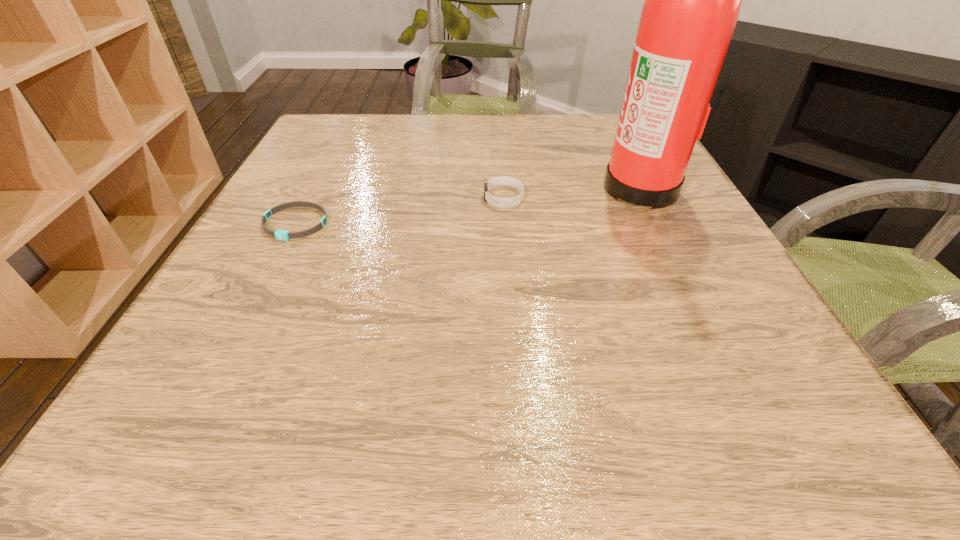
The width and height of the screenshot is (960, 540). Find the location of `vacant area that satisfies the following two spatial constraints: 1. on the outer surface of the second object from right to left; 2. on the buckle of the left wristband`. vacant area that satisfies the following two spatial constraints: 1. on the outer surface of the second object from right to left; 2. on the buckle of the left wristband is located at coordinates (506, 224).

Find the location of a particular element. The height and width of the screenshot is (540, 960). vacant position in the image that satisfies the following two spatial constraints: 1. on the label side of the tallest object; 2. on the buckle of the shortest object is located at coordinates (660, 224).

Where is `vacant position in the image that satisfies the following two spatial constraints: 1. on the label side of the rightmost object; 2. on the buckle of the leftmost object`? The image size is (960, 540). vacant position in the image that satisfies the following two spatial constraints: 1. on the label side of the rightmost object; 2. on the buckle of the leftmost object is located at coordinates (660, 224).

Where is `free spot that satisfies the following two spatial constraints: 1. on the outer surface of the second tallest object; 2. on the buckle of the left wristband`? The width and height of the screenshot is (960, 540). free spot that satisfies the following two spatial constraints: 1. on the outer surface of the second tallest object; 2. on the buckle of the left wristband is located at coordinates (506, 224).

Identify the location of vacant space that satisfies the following two spatial constraints: 1. on the label side of the rightmost object; 2. on the buckle of the leftmost object. (660, 224).

The image size is (960, 540). I want to click on vacant space that satisfies the following two spatial constraints: 1. on the outer surface of the right wristband; 2. on the buckle of the leftmost object, so click(x=506, y=224).